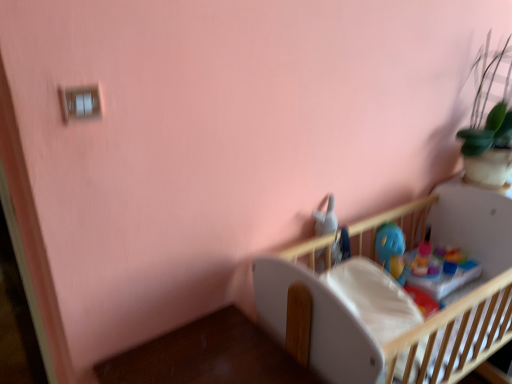
Question: From a real-world perspective, is white matte table at lower right located beneath wooden crib at center?

Choices:
 (A) no
 (B) yes

Answer: (B)

Question: Is white matte table at lower right bigger than wooden crib at center?

Choices:
 (A) yes
 (B) no

Answer: (B)

Question: Is there a large distance between white matte table at lower right and wooden crib at center?

Choices:
 (A) no
 (B) yes

Answer: (A)

Question: Is white matte table at lower right looking in the opposite direction of wooden crib at center?

Choices:
 (A) yes
 (B) no

Answer: (B)

Question: Is white matte table at lower right positioned behind wooden crib at center?

Choices:
 (A) no
 (B) yes

Answer: (A)

Question: Is wooden crib at center in front of or behind white matte table at lower right in the image?

Choices:
 (A) front
 (B) behind

Answer: (B)

Question: Looking at the image, does wooden crib at center seem bigger or smaller compared to white matte table at lower right?

Choices:
 (A) big
 (B) small

Answer: (A)

Question: In terms of height, does wooden crib at center look taller or shorter compared to white matte table at lower right?

Choices:
 (A) short
 (B) tall

Answer: (B)

Question: From a real-world perspective, relative to white matte table at lower right, is wooden crib at center vertically above or below?

Choices:
 (A) above
 (B) below

Answer: (A)

Question: Looking at their shapes, would you say blue plastic toy at upper center is wider or thinner than wooden crib at center?

Choices:
 (A) thin
 (B) wide

Answer: (A)

Question: From the image's perspective, is blue plastic toy at upper center above or below wooden crib at center?

Choices:
 (A) below
 (B) above

Answer: (B)

Question: Relative to wooden crib at center, is blue plastic toy at upper center in front or behind?

Choices:
 (A) front
 (B) behind

Answer: (B)

Question: Is blue plastic toy at upper center bigger or smaller than wooden crib at center?

Choices:
 (A) small
 (B) big

Answer: (A)

Question: Is white matte table at lower right wider or thinner than blue plastic toy at upper center?

Choices:
 (A) wide
 (B) thin

Answer: (A)

Question: From the image's perspective, is white matte table at lower right positioned above or below blue plastic toy at upper center?

Choices:
 (A) below
 (B) above

Answer: (A)